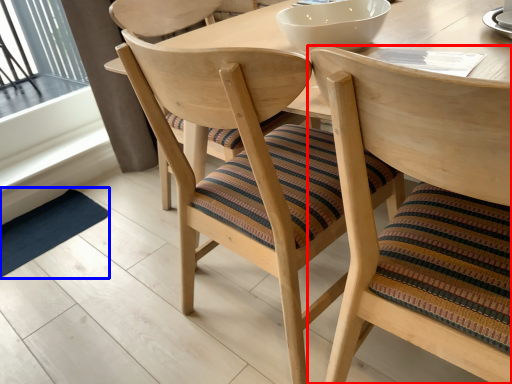
Question: Which of the following is the closest to the observer, chair (highlighted by a red box) or mat (highlighted by a blue box)?

Choices:
 (A) chair
 (B) mat

Answer: (A)